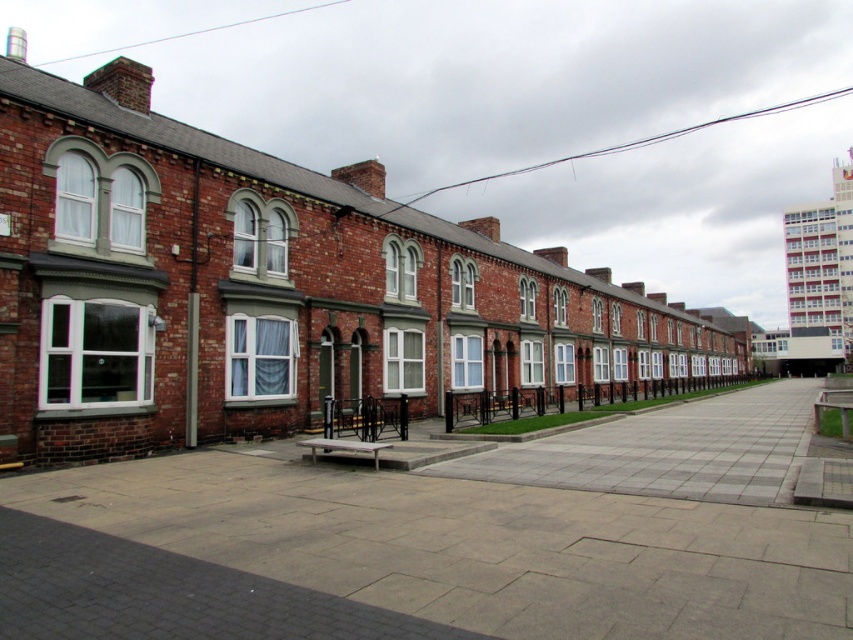
Based on the photo, you are a delivery person with a cart that is 5 meters long. You need to move your cart between the gray concrete pavement at center and the brick wall at center. Based on the scene, can you fit your cart in the space between them?

The gray concrete pavement at center and brick wall at center are 4.58 meters apart, so the cart that is 5 meters long cannot fit in the space between them.

You are a delivery person trying to park your 1.2 meter wide cart between the gray concrete pavement at center and the brick wall at center. Can your cart fit through the space between them?

The gray concrete pavement at center is narrower than the brick wall at center, so the space between them is less than 1.2 meters. Therefore, your cart cannot fit through the space between the gray concrete pavement at center and the brick wall at center.